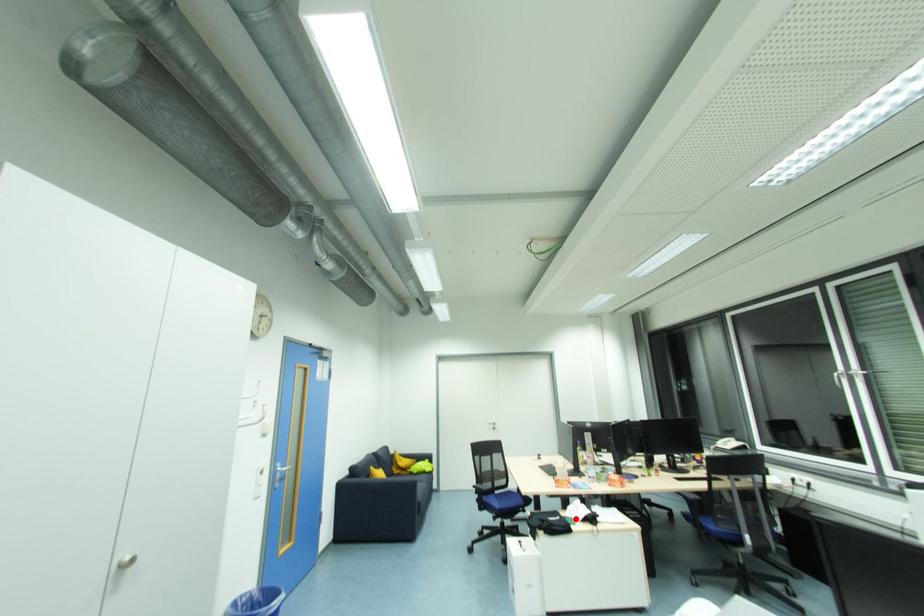
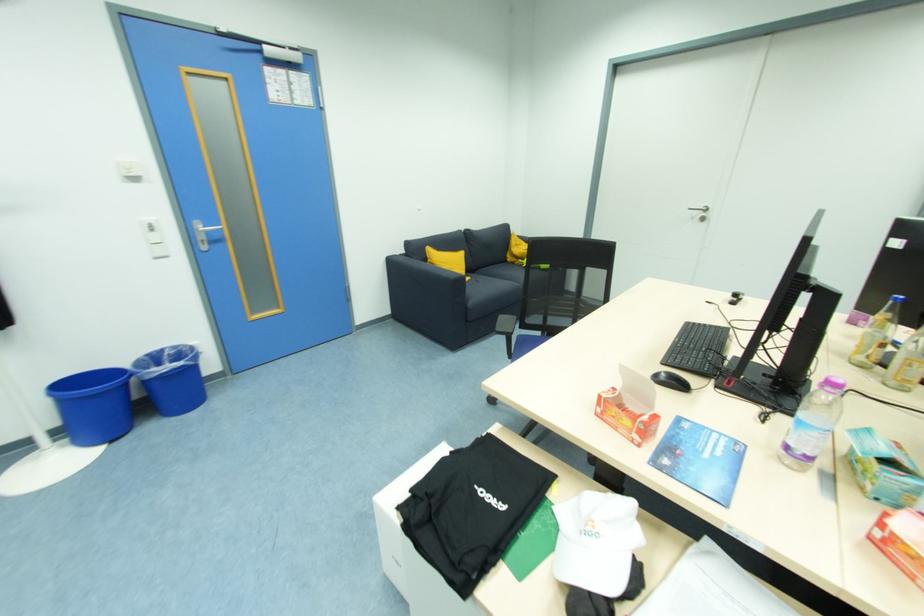
Find the pixel in the second image that matches the highlighted location in the first image.

(563, 535)